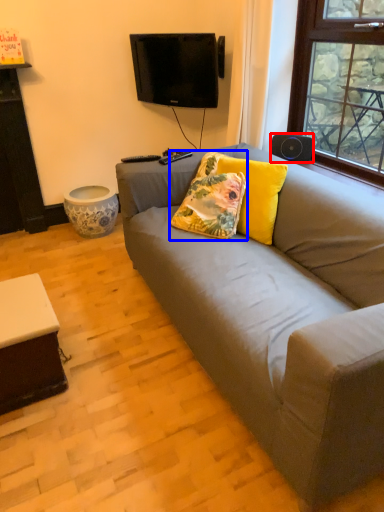
Question: Which object is closer to the camera taking this photo, loudspeaker (highlighted by a red box) or pillow (highlighted by a blue box)?

Choices:
 (A) loudspeaker
 (B) pillow

Answer: (B)